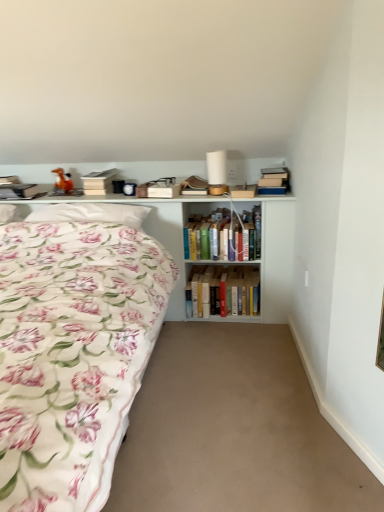
Question: Would you say hardcover book at upper center, which is the 1th paperback book from right to left, is part of white matte paperback book at upper center, the 1th paperback book positioned from the left,'s contents?

Choices:
 (A) yes
 (B) no

Answer: (B)

Question: Is white matte paperback book at upper center, which is the third paperback book in right-to-left order, not inside hardcover book at upper center, which is the 3th paperback book in left-to-right order?

Choices:
 (A) no
 (B) yes

Answer: (B)

Question: Is white matte paperback book at upper center, which is the third paperback book in right-to-left order, to the left of hardcover book at upper center, which is the 1th paperback book from right to left, from the viewer's perspective?

Choices:
 (A) no
 (B) yes

Answer: (B)

Question: Is white matte paperback book at upper center, the 1th paperback book positioned from the left, beside hardcover book at upper center, which is the 1th paperback book from right to left?

Choices:
 (A) yes
 (B) no

Answer: (B)

Question: Considering the relative sizes of white matte paperback book at upper center, the 1th paperback book positioned from the left, and hardcover book at upper center, which is the 3th paperback book in left-to-right order, in the image provided, is white matte paperback book at upper center, the 1th paperback book positioned from the left, smaller than hardcover book at upper center, which is the 3th paperback book in left-to-right order,?

Choices:
 (A) no
 (B) yes

Answer: (A)

Question: Does white matte paperback book at upper center, the 1th paperback book positioned from the left, have a lesser width compared to hardcover book at upper center, which is the 1th paperback book from right to left?

Choices:
 (A) yes
 (B) no

Answer: (A)

Question: Can you confirm if matte brown paperback book at upper center, which is counted as the second paperback book, starting from the right, is shorter than hardcover books at center, which is the 3th book from top to bottom?

Choices:
 (A) no
 (B) yes

Answer: (B)

Question: Does matte brown paperback book at upper center, which is counted as the second paperback book, starting from the right, contain hardcover books at center, the 1th book positioned from the bottom?

Choices:
 (A) no
 (B) yes

Answer: (A)

Question: Can you confirm if matte brown paperback book at upper center, which is counted as the second paperback book, starting from the right, is smaller than hardcover books at center, which is the 3th book from top to bottom?

Choices:
 (A) yes
 (B) no

Answer: (A)

Question: Does matte brown paperback book at upper center, which is counted as the second paperback book, starting from the right, appear on the left side of hardcover books at center, which is the 3th book from top to bottom?

Choices:
 (A) yes
 (B) no

Answer: (A)

Question: From the image's perspective, is matte brown paperback book at upper center, which is counted as the second paperback book, starting from the right, on top of hardcover books at center, the 1th book positioned from the bottom?

Choices:
 (A) yes
 (B) no

Answer: (A)

Question: Does matte brown paperback book at upper center, arranged as the 2th paperback book when viewed from the left, have a greater width compared to hardcover books at center, which is the 3th book from top to bottom?

Choices:
 (A) no
 (B) yes

Answer: (A)

Question: Is beige carpet at center not inside orange matte toy horse at upper left?

Choices:
 (A) yes
 (B) no

Answer: (A)